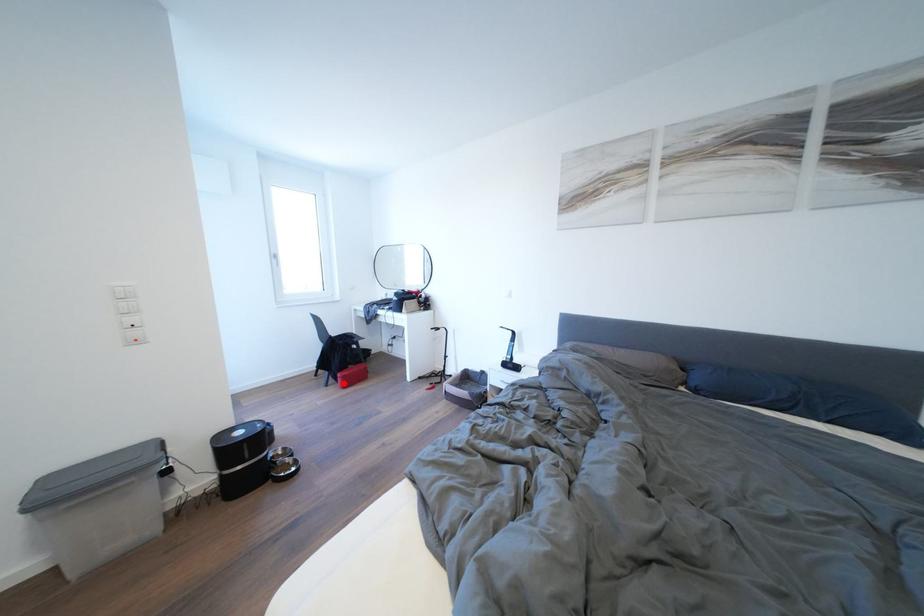
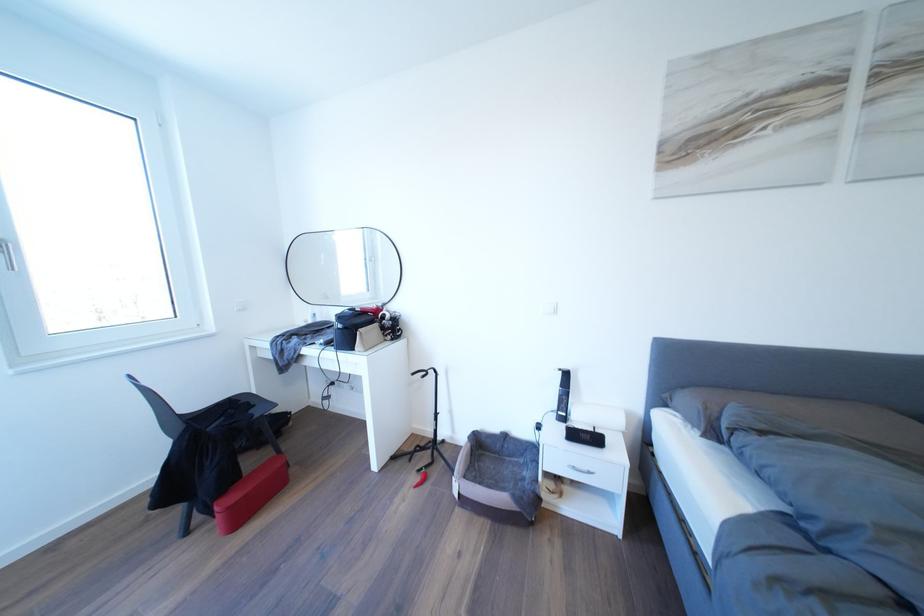
Question: I am providing you with two images of the same scene from different viewpoints. A red point is shown in image1. For the corresponding object point in image2, is it positioned nearer or farther from the camera?

Choices:
 (A) Nearer
 (B) Farther

Answer: (A)